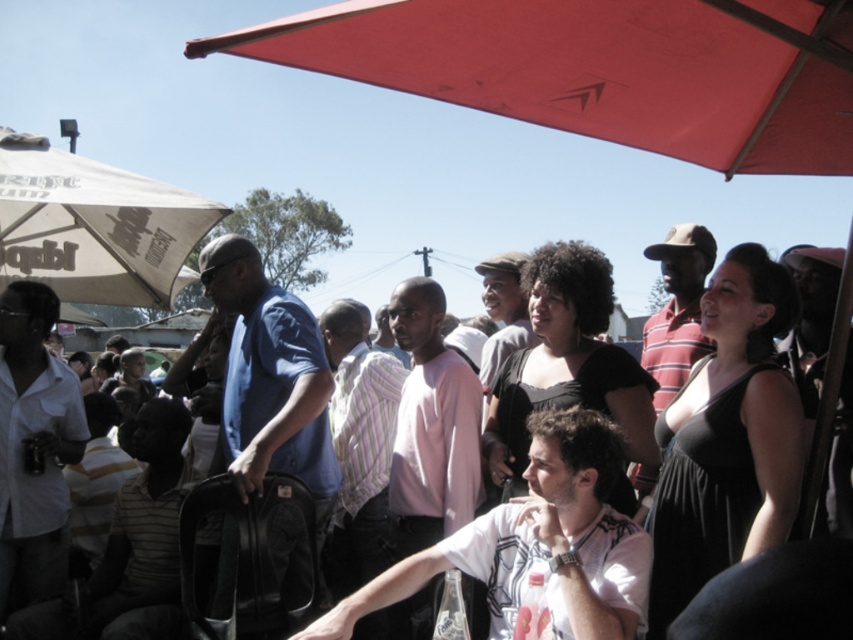
You are organizing a group photo and need to arrange two people wearing the matte black dress at center and the pink cotton shirt at center. Based on their clothing widths, which clothing should be placed on the left to ensure they fit side by side without overlapping?

The matte black dress at center might be wider than the pink cotton shirt at center, so placing the wider matte black dress at center on the left would allow both to fit side by side without overlapping.